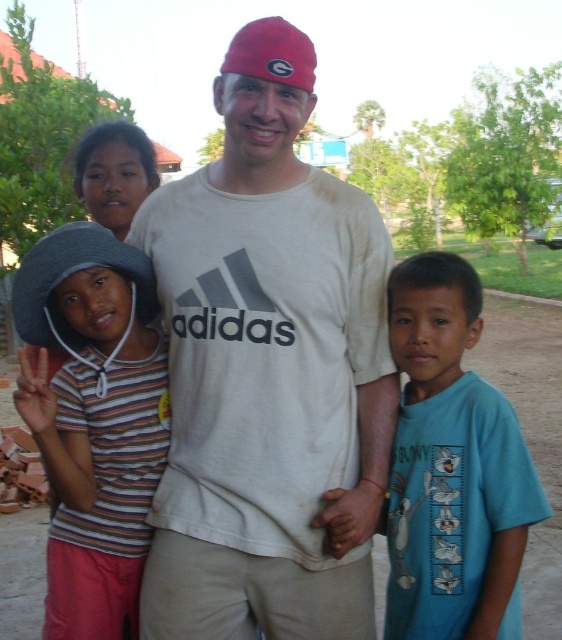
Question: Which point is closer to the camera?

Choices:
 (A) (406, 337)
 (B) (85, 228)
 (C) (323, 323)
 (D) (161, 401)

Answer: (A)

Question: Which point is farther from the camera taking this photo?

Choices:
 (A) (413, 280)
 (B) (65, 323)
 (C) (144, 292)

Answer: (C)

Question: Does striped fabric hat at left have a larger size compared to gray fabric baseball hat at left?

Choices:
 (A) yes
 (B) no

Answer: (A)

Question: Is striped fabric hat at left wider than gray fabric baseball hat at left?

Choices:
 (A) yes
 (B) no

Answer: (A)

Question: Considering the relative positions of white cotton t-shirt at center and gray fabric baseball hat at left in the image provided, where is white cotton t-shirt at center located with respect to gray fabric baseball hat at left?

Choices:
 (A) below
 (B) above

Answer: (A)

Question: Which point is closer to the camera?

Choices:
 (A) (84, 228)
 (B) (337, 634)
 (C) (112, 538)

Answer: (B)